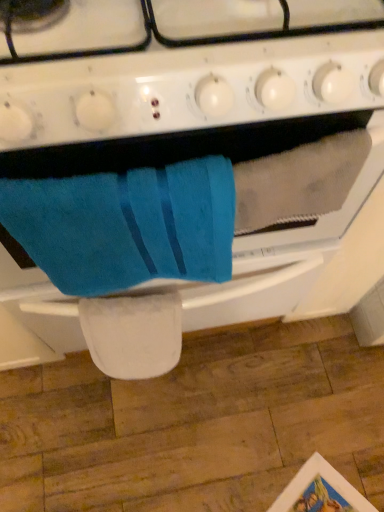
Question: From the image's perspective, is blue terry cloth towel at center below white glossy gas stove at upper center?

Choices:
 (A) no
 (B) yes

Answer: (B)

Question: Can you confirm if blue terry cloth towel at center is bigger than white glossy gas stove at upper center?

Choices:
 (A) yes
 (B) no

Answer: (A)

Question: Can you confirm if blue terry cloth towel at center is wider than white glossy gas stove at upper center?

Choices:
 (A) no
 (B) yes

Answer: (B)

Question: From a real-world perspective, is blue terry cloth towel at center on top of white glossy gas stove at upper center?

Choices:
 (A) yes
 (B) no

Answer: (B)

Question: Is blue terry cloth towel at center oriented away from white glossy gas stove at upper center?

Choices:
 (A) no
 (B) yes

Answer: (A)

Question: From their relative heights in the image, would you say blue soft towel at center is taller or shorter than blue terry cloth towel at center?

Choices:
 (A) short
 (B) tall

Answer: (A)

Question: Based on their positions, is blue soft towel at center located to the left or right of blue terry cloth towel at center?

Choices:
 (A) right
 (B) left

Answer: (B)

Question: Relative to blue terry cloth towel at center, is blue soft towel at center in front or behind?

Choices:
 (A) front
 (B) behind

Answer: (B)

Question: From a real-world perspective, relative to blue terry cloth towel at center, is blue soft towel at center vertically above or below?

Choices:
 (A) below
 (B) above

Answer: (B)

Question: Based on their sizes in the image, would you say blue terry cloth towel at center is bigger or smaller than blue soft towel at center?

Choices:
 (A) big
 (B) small

Answer: (A)

Question: Based on their positions, is blue terry cloth towel at center located to the left or right of blue soft towel at center?

Choices:
 (A) right
 (B) left

Answer: (A)

Question: Would you say blue terry cloth towel at center is inside or outside blue soft towel at center?

Choices:
 (A) outside
 (B) inside

Answer: (A)

Question: From a real-world perspective, is blue terry cloth towel at center positioned above or below blue soft towel at center?

Choices:
 (A) above
 (B) below

Answer: (B)

Question: Choose the correct answer: Is blue soft towel at center inside white glossy gas stove at upper center or outside it?

Choices:
 (A) inside
 (B) outside

Answer: (B)

Question: From their relative heights in the image, would you say blue soft towel at center is taller or shorter than white glossy gas stove at upper center?

Choices:
 (A) short
 (B) tall

Answer: (B)